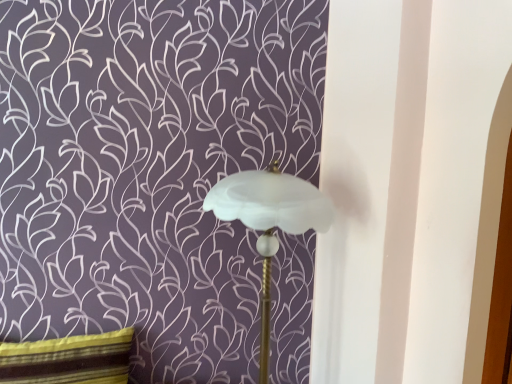
Question: Is striped fabric pillow at lower left looking in the opposite direction of white frosted glass lampshade at center?

Choices:
 (A) yes
 (B) no

Answer: (B)

Question: Does striped fabric pillow at lower left have a lesser height compared to white frosted glass lampshade at center?

Choices:
 (A) yes
 (B) no

Answer: (A)

Question: Is striped fabric pillow at lower left wider than white frosted glass lampshade at center?

Choices:
 (A) yes
 (B) no

Answer: (B)

Question: Is striped fabric pillow at lower left to the left of white frosted glass lampshade at center from the viewer's perspective?

Choices:
 (A) yes
 (B) no

Answer: (A)

Question: Is striped fabric pillow at lower left positioned far away from white frosted glass lampshade at center?

Choices:
 (A) no
 (B) yes

Answer: (A)

Question: Is striped fabric pillow at lower left positioned behind white frosted glass lampshade at center?

Choices:
 (A) yes
 (B) no

Answer: (A)

Question: From the image's perspective, is white frosted glass lampshade at center located above striped fabric pillow at lower left?

Choices:
 (A) yes
 (B) no

Answer: (A)

Question: From a real-world perspective, is white frosted glass lampshade at center physically below striped fabric pillow at lower left?

Choices:
 (A) no
 (B) yes

Answer: (A)

Question: Does white frosted glass lampshade at center have a lesser height compared to striped fabric pillow at lower left?

Choices:
 (A) no
 (B) yes

Answer: (A)

Question: Are white frosted glass lampshade at center and striped fabric pillow at lower left beside each other?

Choices:
 (A) no
 (B) yes

Answer: (A)

Question: Can you confirm if white frosted glass lampshade at center is taller than striped fabric pillow at lower left?

Choices:
 (A) yes
 (B) no

Answer: (A)

Question: Is white frosted glass lampshade at center looking in the opposite direction of striped fabric pillow at lower left?

Choices:
 (A) no
 (B) yes

Answer: (A)

Question: Considering the positions of point (34, 377) and point (208, 208), is point (34, 377) closer or farther from the camera than point (208, 208)?

Choices:
 (A) farther
 (B) closer

Answer: (A)